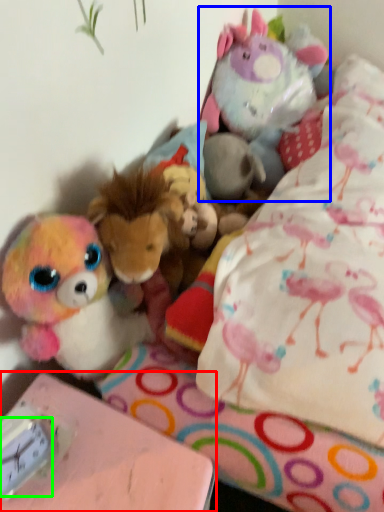
Question: Estimate the real-world distances between objects in this image. Which object is closer to table (highlighted by a red box), toy (highlighted by a blue box) or clock (highlighted by a green box)?

Choices:
 (A) toy
 (B) clock

Answer: (B)